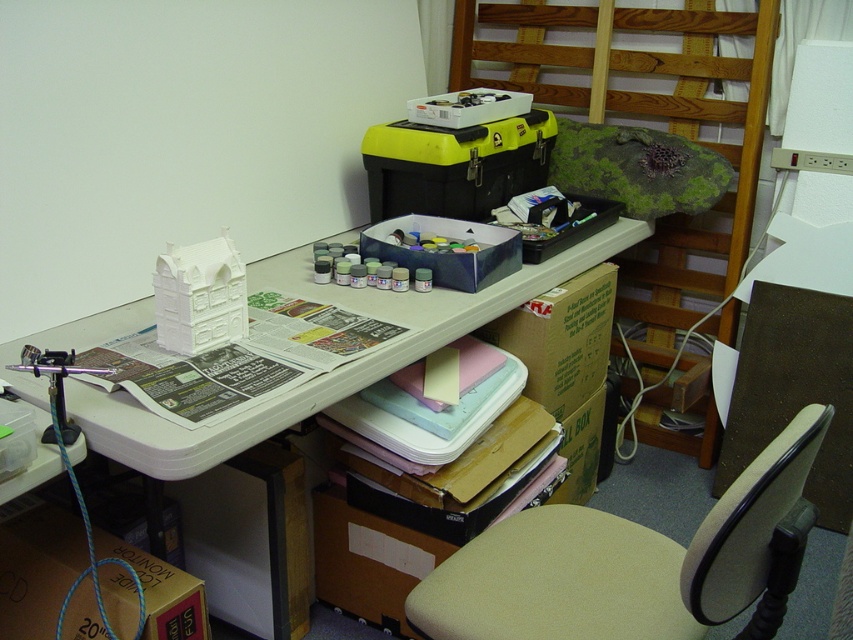
You are standing at the center of the room and want to sit down in the beige fabric swivel chair at lower right. Based on your current position, in which direction should you move to reach the chair?

The beige fabric swivel chair at lower right is located at point 0.881 on the x axis and 0.744 on the y axis. Since you are at the center of the room, which would be coordinates approximately 0.5 on both axes, you should move towards the right and forward to reach the chair.

You are standing at the edge of the table and want to reach both the point at the coordinates (554, 589) and the point at (312, 403). Which point will you reach first?

The point at (554, 589) is closer to you than the point at (312, 403), so you will reach the point at (554, 589) first.